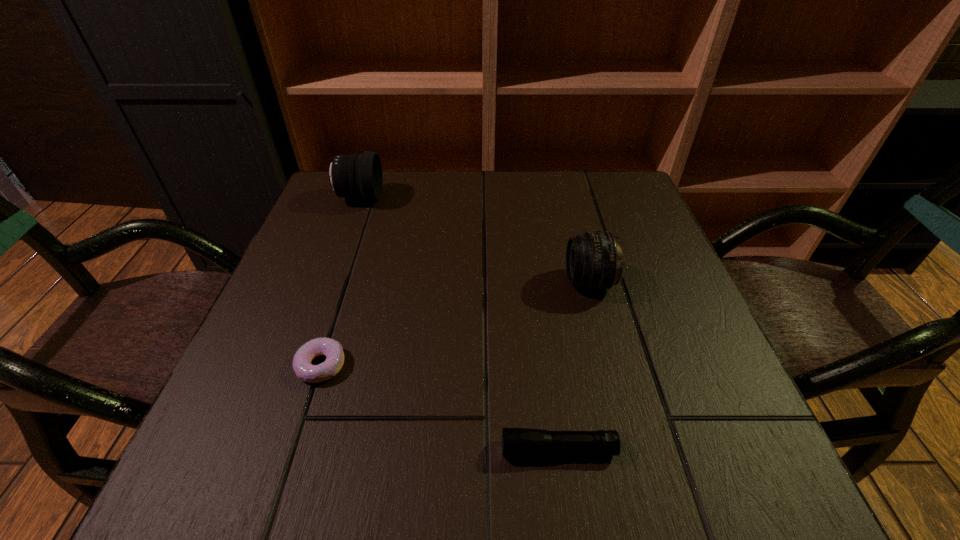
Locate an element on the screen. The image size is (960, 540). object at the right edge is located at coordinates (594, 260).

Where is `object located at the far left corner`? object located at the far left corner is located at coordinates (360, 176).

The height and width of the screenshot is (540, 960). I want to click on free space at the far edge of the desktop, so click(467, 171).

Locate an element on the screen. vacant space at the left edge is located at coordinates (348, 308).

Image resolution: width=960 pixels, height=540 pixels. In the image, there is a desktop. What are the coordinates of `vacant region at the right edge` in the screenshot? It's located at (626, 309).

The image size is (960, 540). Find the location of `vacant space at the near left corner of the desktop`. vacant space at the near left corner of the desktop is located at coordinates (294, 443).

Find the location of a particular element. free space at the far right corner of the desktop is located at coordinates (635, 212).

The width and height of the screenshot is (960, 540). I want to click on free space at the near right corner of the desktop, so click(x=671, y=456).

This screenshot has width=960, height=540. In order to click on empty location between the third nearest object and the left telephoto lens in this screenshot , I will do `click(474, 240)`.

Image resolution: width=960 pixels, height=540 pixels. I want to click on free space that is in between the nearest object and the nearer telephoto lens, so click(573, 366).